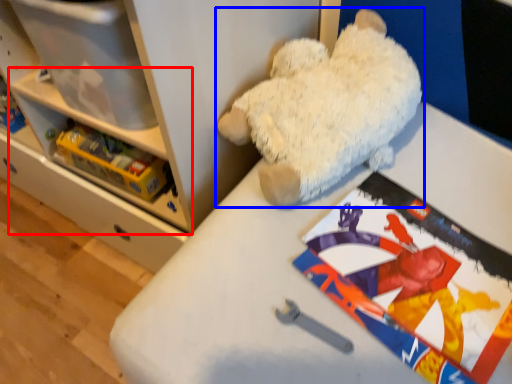
Question: Which point is further to the camera, shelf (highlighted by a red box) or teddy bear (highlighted by a blue box)?

Choices:
 (A) shelf
 (B) teddy bear

Answer: (A)